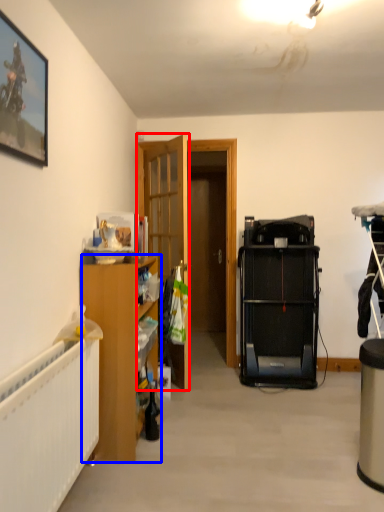
Question: Which point is closer to the camera, door (highlighted by a red box) or cabinetry (highlighted by a blue box)?

Choices:
 (A) door
 (B) cabinetry

Answer: (B)